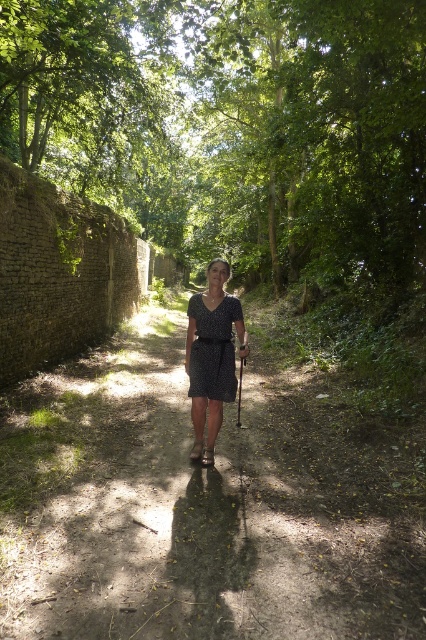
Can you confirm if dirt path at center is bigger than black dotted dress at center?

Yes, dirt path at center is bigger than black dotted dress at center.

Does dirt path at center come behind black dotted dress at center?

No, it is not.

The width and height of the screenshot is (426, 640). I want to click on dirt path at center, so pos(204,502).

Which is more to the right, dirt path at center or dark dotted dress at center?

dark dotted dress at center

Which is below, dirt path at center or dark dotted dress at center?

Positioned lower is dirt path at center.

Between point (334, 600) and point (242, 348), which one is positioned behind?

Point (242, 348)

This screenshot has height=640, width=426. I want to click on dirt path at center, so click(x=204, y=502).

Is dirt path at center taller than green leafy tree at center?

No.

Can you confirm if dirt path at center is bigger than green leafy tree at center?

Incorrect, dirt path at center is not larger than green leafy tree at center.

Is point (337, 525) positioned behind point (215, 108)?

No, (337, 525) is in front of (215, 108).

Identify the location of dirt path at center. This screenshot has height=640, width=426. (204, 502).